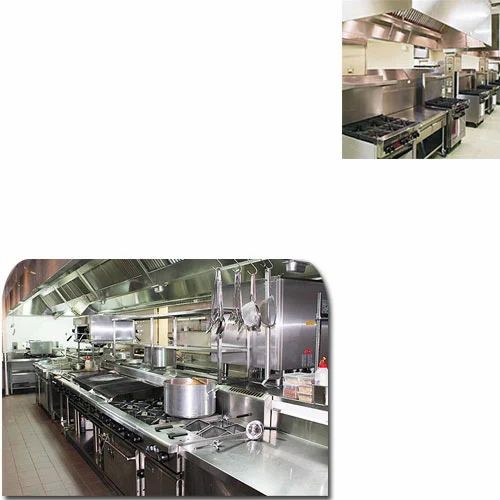
The width and height of the screenshot is (500, 500). In order to click on countertop in this screenshot , I will do `click(268, 460)`, `click(427, 114)`.